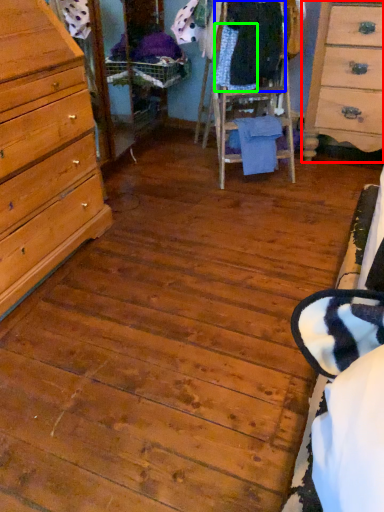
Question: Which object is the farthest from chest of drawers (highlighted by a red box)? Choose among these: clothing (highlighted by a blue box) or clothing (highlighted by a green box).

Choices:
 (A) clothing
 (B) clothing

Answer: (B)